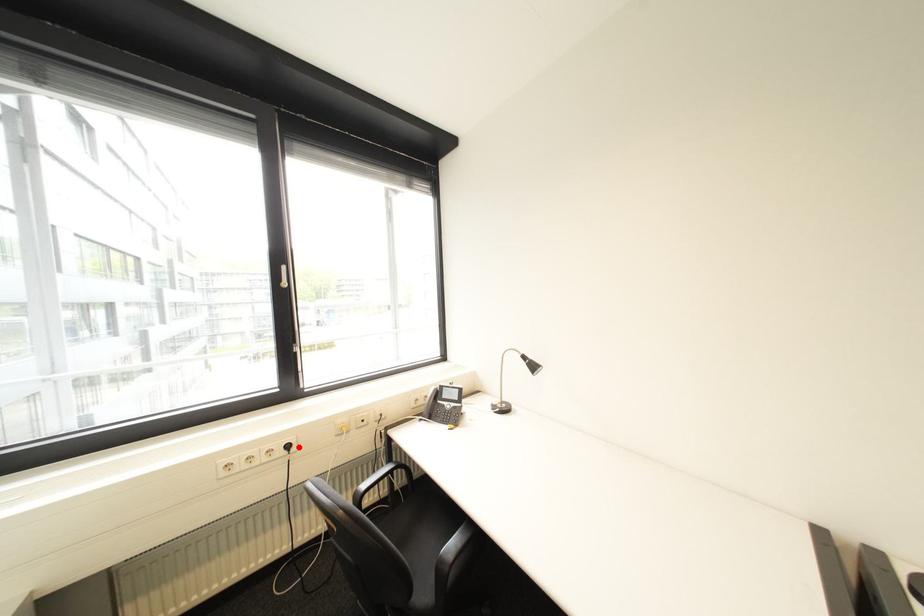
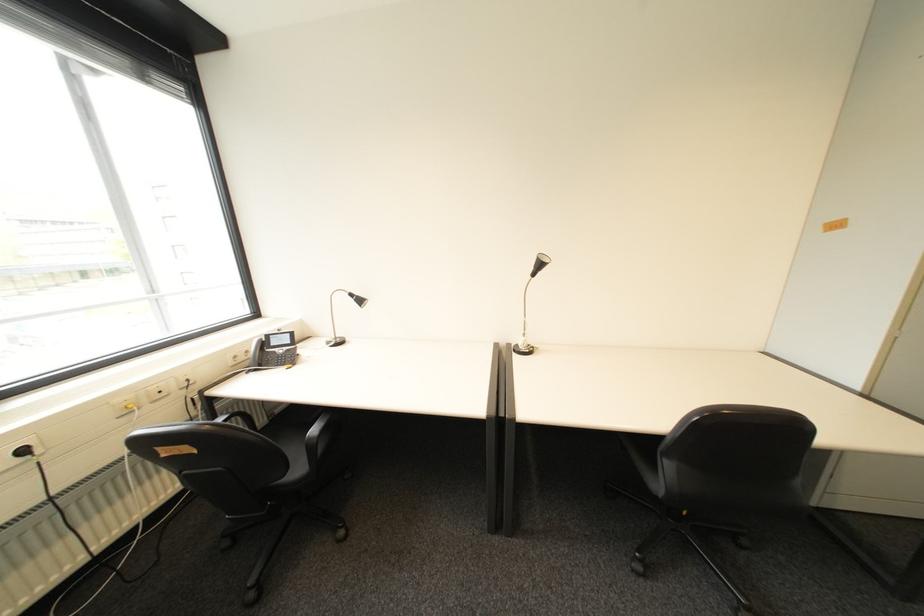
Locate, in the second image, the point that corresponds to the highlighted location in the first image.

(34, 452)